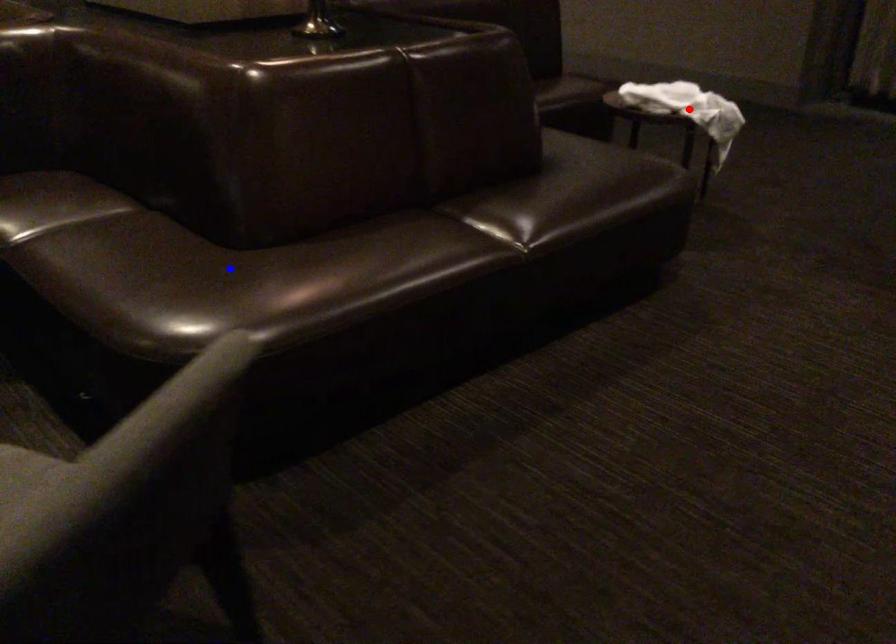
Question: Which of the two points in the image is closer to the camera?

Choices:
 (A) Blue point is closer.
 (B) Red point is closer.

Answer: (A)